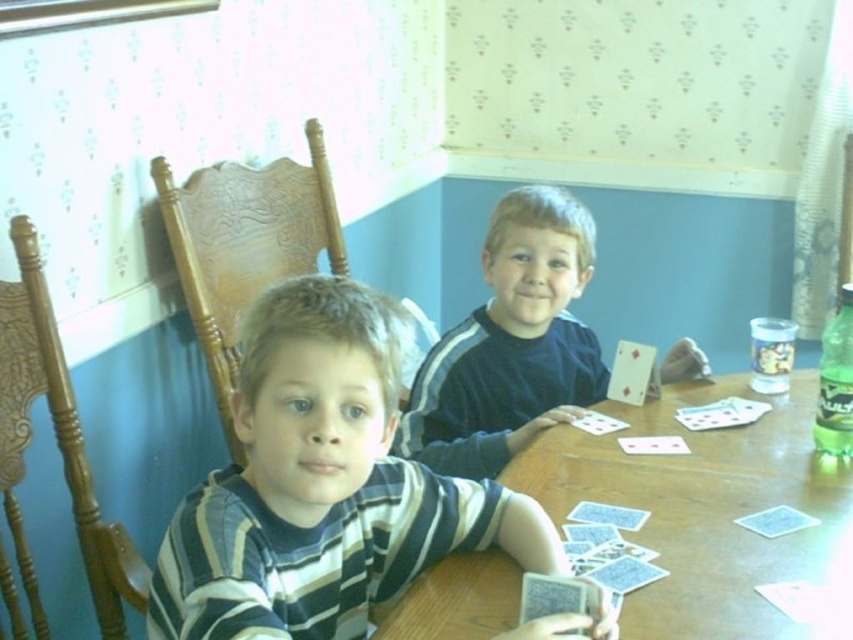
Is dark blue jersey at center thinner than red glossy playing card at center?

In fact, dark blue jersey at center might be wider than red glossy playing card at center.

Which is below, dark blue jersey at center or red glossy playing card at center?

dark blue jersey at center is lower down.

The image size is (853, 640). In order to click on dark blue jersey at center in this screenshot , I will do `click(511, 342)`.

Locate an element on the screen. dark blue jersey at center is located at coordinates (511, 342).

Is blue cardboard cards at lower center closer to the viewer compared to red glossy playing card at center?

Yes.

Can you confirm if blue cardboard cards at lower center is smaller than red glossy playing card at center?

No.

This screenshot has width=853, height=640. In order to click on blue cardboard cards at lower center in this screenshot , I will do `click(608, 547)`.

Can you confirm if striped cotton shirt at center is bigger than dark blue jersey at center?

No.

Describe the element at coordinates (323, 486) in the screenshot. The height and width of the screenshot is (640, 853). I see `striped cotton shirt at center` at that location.

What do you see at coordinates (323, 486) in the screenshot? I see `striped cotton shirt at center` at bounding box center [323, 486].

Where is `striped cotton shirt at center`? striped cotton shirt at center is located at coordinates (323, 486).